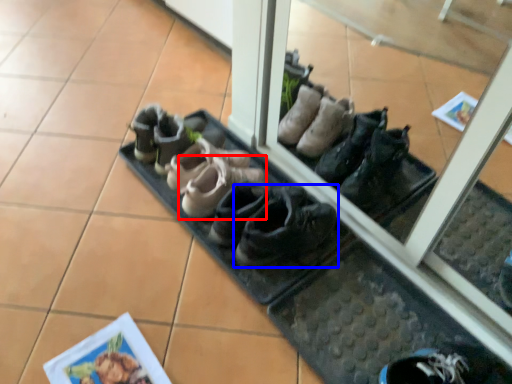
Question: Among these objects, which one is nearest to the camera, footwear (highlighted by a red box) or footwear (highlighted by a blue box)?

Choices:
 (A) footwear
 (B) footwear

Answer: (B)